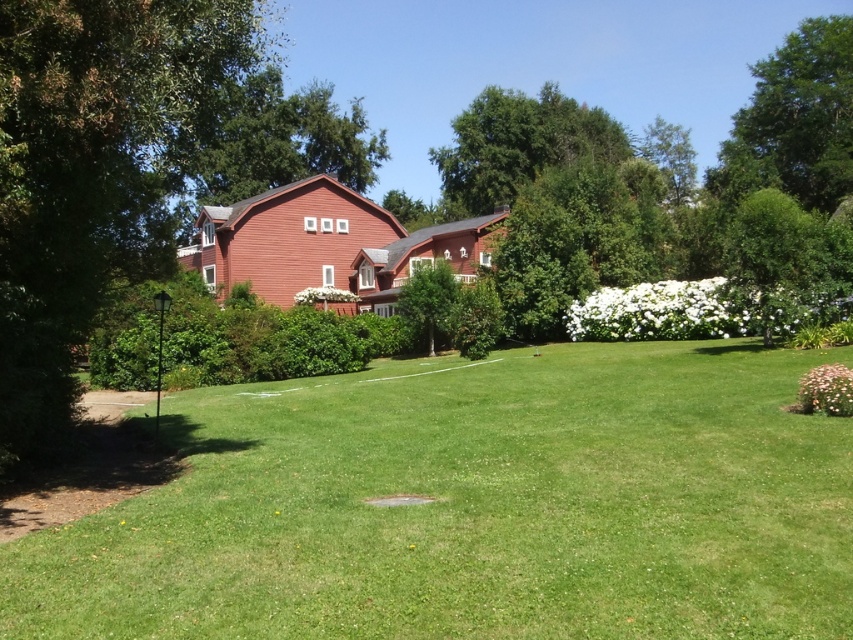
Question: Is green leafy tree at left behind green leafy tree at upper center?

Choices:
 (A) no
 (B) yes

Answer: (A)

Question: Based on their relative distances, which object is farther from the green leafy tree at left?

Choices:
 (A) red wooden barn at center
 (B) green leafy tree at center
 (C) matte red barn at center
 (D) green leafy tree at upper center

Answer: (D)

Question: Which object is closer to the camera taking this photo?

Choices:
 (A) green leafy tree at left
 (B) matte red barn at center

Answer: (A)

Question: Can you confirm if green grassy at center is bigger than red wooden barn at center?

Choices:
 (A) no
 (B) yes

Answer: (A)

Question: Which point is farther to the camera?

Choices:
 (A) (833, 88)
 (B) (416, 275)
 (C) (479, 140)

Answer: (C)

Question: In this image, where is green leafy tree at upper right located relative to green leafy tree at center?

Choices:
 (A) below
 (B) above

Answer: (B)